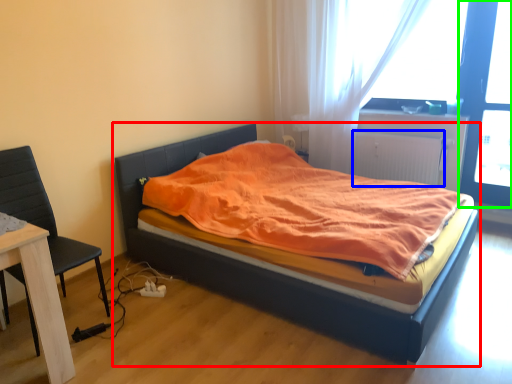
Question: Which object is positioned farthest from bed (highlighted by a red box)? Select from radiator (highlighted by a blue box) and screen door (highlighted by a green box).

Choices:
 (A) radiator
 (B) screen door

Answer: (B)